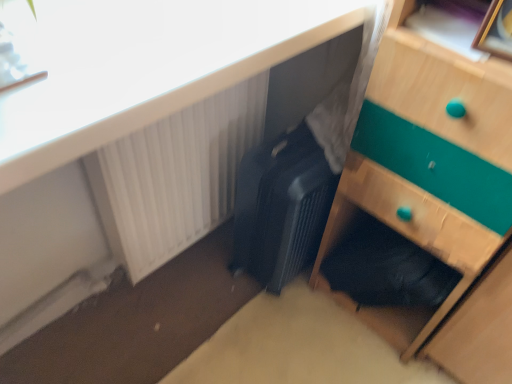
The image size is (512, 384). In order to click on free space above matte black suitcase at center (from a real-world perspective) in this screenshot , I will do click(x=143, y=29).